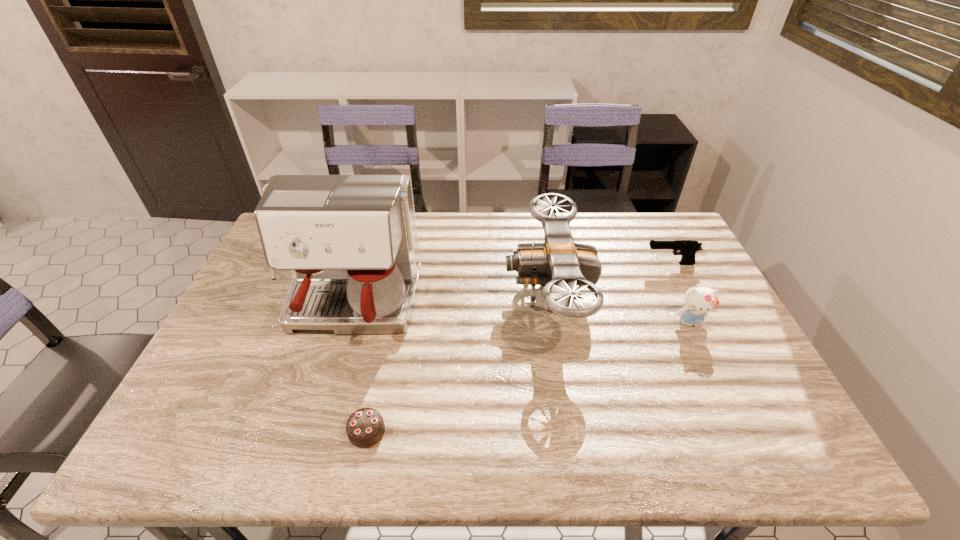
Locate an element on the screen. The height and width of the screenshot is (540, 960). pistol situated at the right edge is located at coordinates (688, 248).

At what (x,y) coordinates should I click in order to perform the action: click on vacant space at the far edge of the desktop. Please return your answer as a coordinate pair (x, y). This screenshot has height=540, width=960. Looking at the image, I should click on tap(591, 222).

The height and width of the screenshot is (540, 960). In the image, there is a desktop. Find the location of `vacant space at the near edge`. vacant space at the near edge is located at coordinates (699, 456).

The image size is (960, 540). I want to click on vacant space at the left edge of the desktop, so click(207, 356).

I want to click on free space at the right edge, so click(750, 397).

This screenshot has width=960, height=540. Identify the location of unoccupied area between the second shortest object and the kitten. (680, 293).

Identify the location of free space between the kitten and the chocolate cake. (528, 377).

You are a GUI agent. You are given a task and a screenshot of the screen. Output one action in this format:
    pyautogui.click(x=<x>, y=<y>)
    Task: Click on the free space between the coffee maker and the kitten
    The image size is (960, 540).
    Given the screenshot: What is the action you would take?
    pyautogui.click(x=520, y=315)

This screenshot has height=540, width=960. I want to click on unoccupied area between the coffee maker and the chocolate cake, so click(x=358, y=370).

Find the location of `unoccupied area between the pistol and the second tallest object`. unoccupied area between the pistol and the second tallest object is located at coordinates (609, 279).